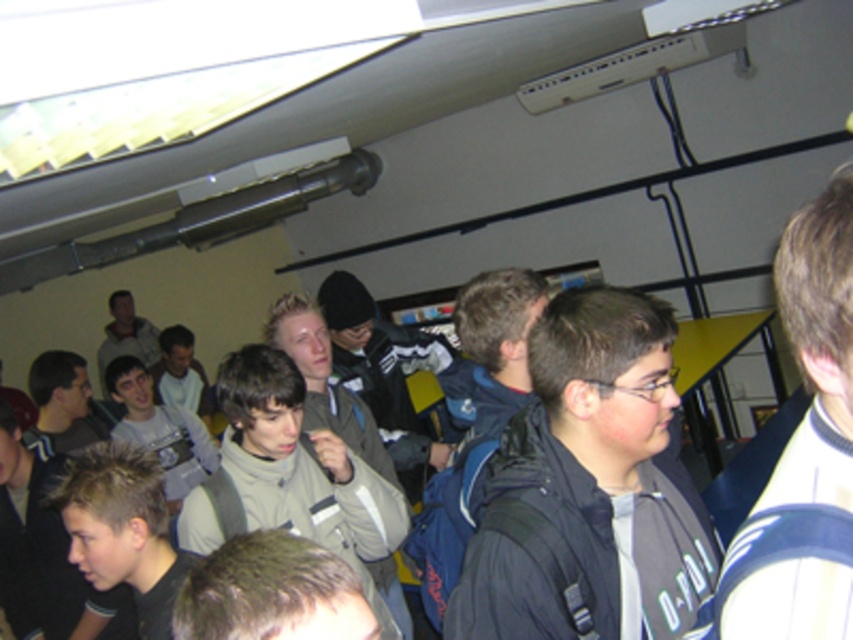
Between dark brown hair at center and spiky hair at center, which one is positioned higher?

dark brown hair at center is higher up.

In the scene shown: How far apart are dark brown hair at center and spiky hair at center?

They are 3.91 feet apart.

Does point (788, 316) come behind point (163, 557)?

No, it is in front of (163, 557).

Locate an element on the screen. dark brown hair at center is located at coordinates (804, 451).

Is spiky hair at center behind light gray jacket at center?

No, it is in front of light gray jacket at center.

Is spiky hair at center in front of light gray jacket at center?

That is True.

The width and height of the screenshot is (853, 640). I want to click on spiky hair at center, so click(x=123, y=529).

Is dark gray jacket at center wider than dark brown hair at center?

Yes, dark gray jacket at center is wider than dark brown hair at center.

Is dark gray jacket at center thinner than dark brown hair at center?

No.

Does point (519, 618) come behind point (788, 442)?

Yes, it is behind point (788, 442).

You are a GUI agent. You are given a task and a screenshot of the screen. Output one action in this format:
    pyautogui.click(x=<x>, y=<y>)
    Task: Click on the dark gray jacket at center
    The width and height of the screenshot is (853, 640).
    Given the screenshot: What is the action you would take?
    pyautogui.click(x=590, y=484)